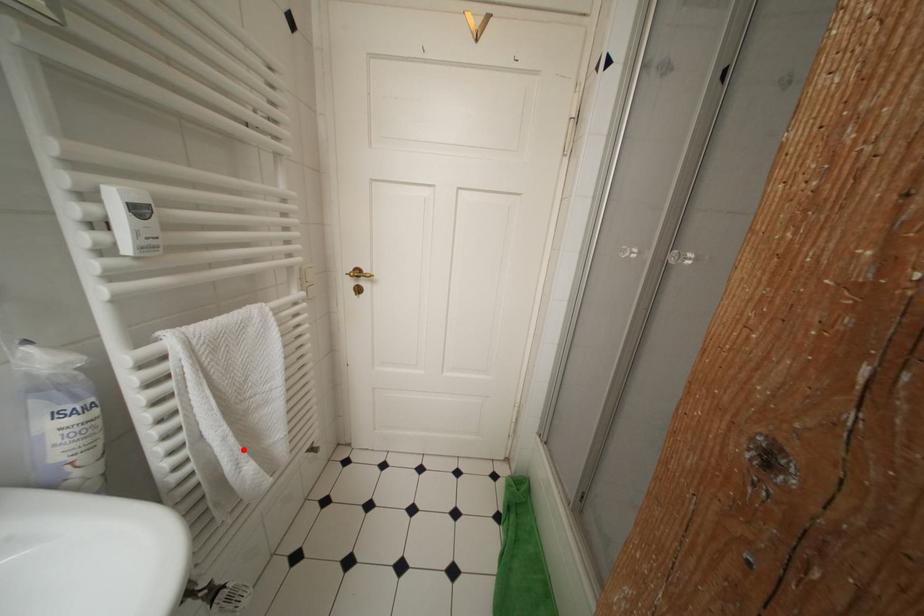
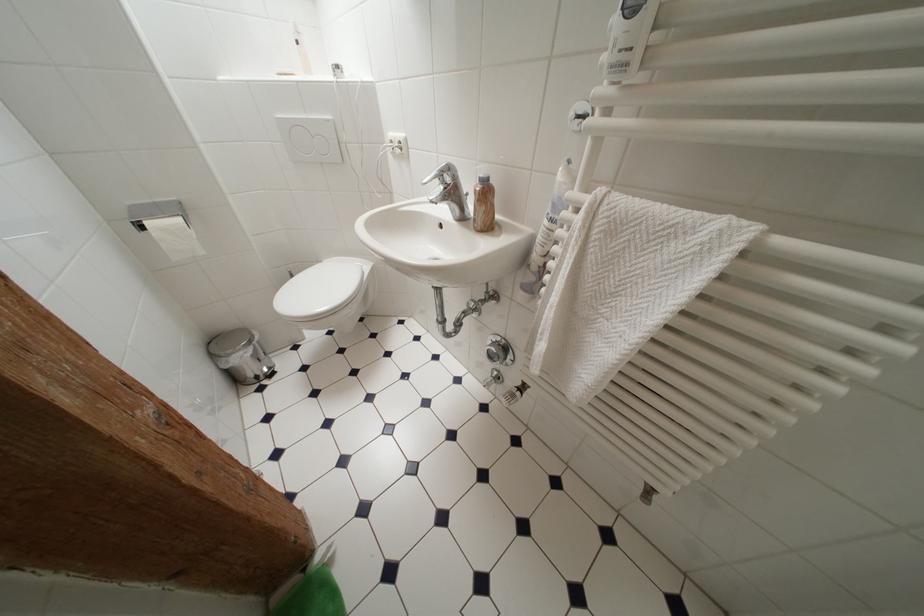
In the second image, find the point that corresponds to the highlighted location in the first image.

(555, 325)